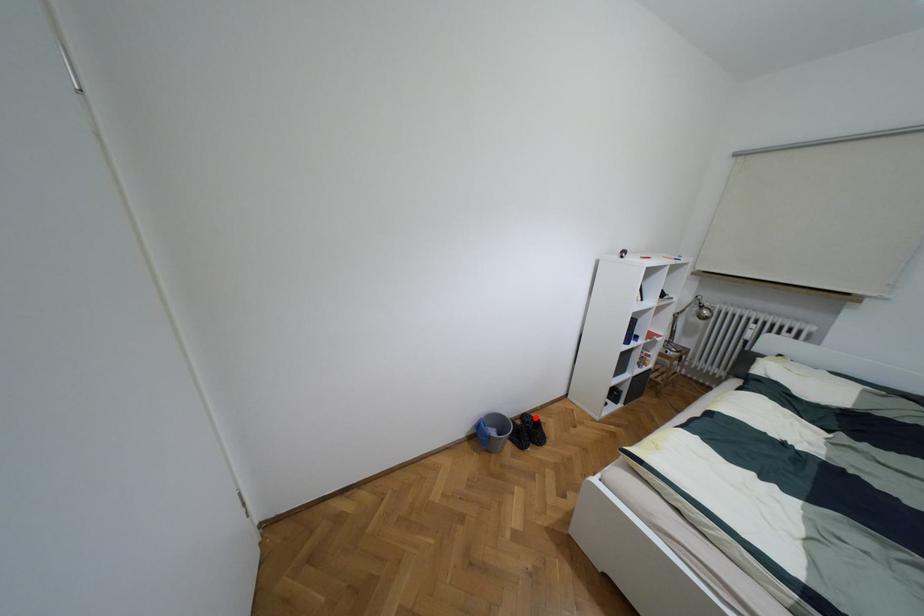
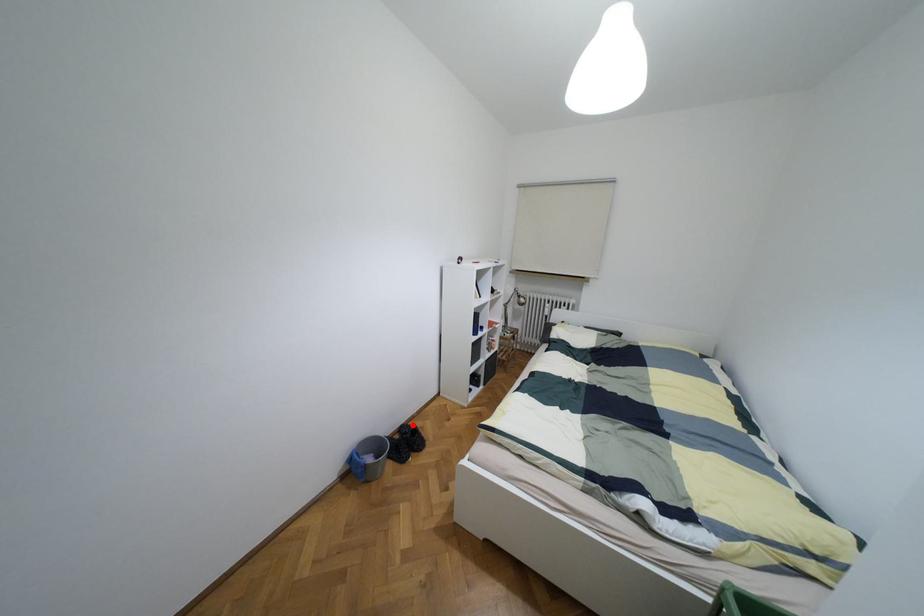
I am providing you with two images of the same scene from different viewpoints. A red point is marked on the first image and another point is marked on the second image. Is the marked point in image1 the same physical position as the marked point in image2?

Yes